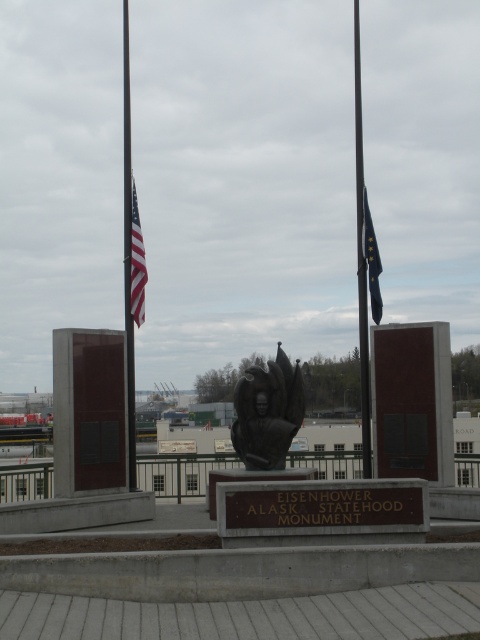
Between polished metal flagpole at left and matte black flag at center, which one appears on the right side from the viewer's perspective?

Positioned to the right is matte black flag at center.

Where is `polished metal flagpole at left`? polished metal flagpole at left is located at coordinates (128, 253).

Where is `polished metal flagpole at left`? The image size is (480, 640). polished metal flagpole at left is located at coordinates (128, 253).

Is matte black flag at center to the left of dark blue fabric flag at right from the viewer's perspective?

Yes, matte black flag at center is to the left of dark blue fabric flag at right.

Can you confirm if matte black flag at center is positioned above dark blue fabric flag at right?

Correct, matte black flag at center is located above dark blue fabric flag at right.

Where is `matte black flag at center`? The width and height of the screenshot is (480, 640). matte black flag at center is located at coordinates (136, 262).

Can you confirm if bronze statue at center is smaller than metallic flagpole at center?

Yes.

Which is behind, point (240, 378) or point (361, 262)?

The point (240, 378) is behind.

Find the location of a particular element. Image resolution: width=480 pixels, height=640 pixels. bronze statue at center is located at coordinates (267, 412).